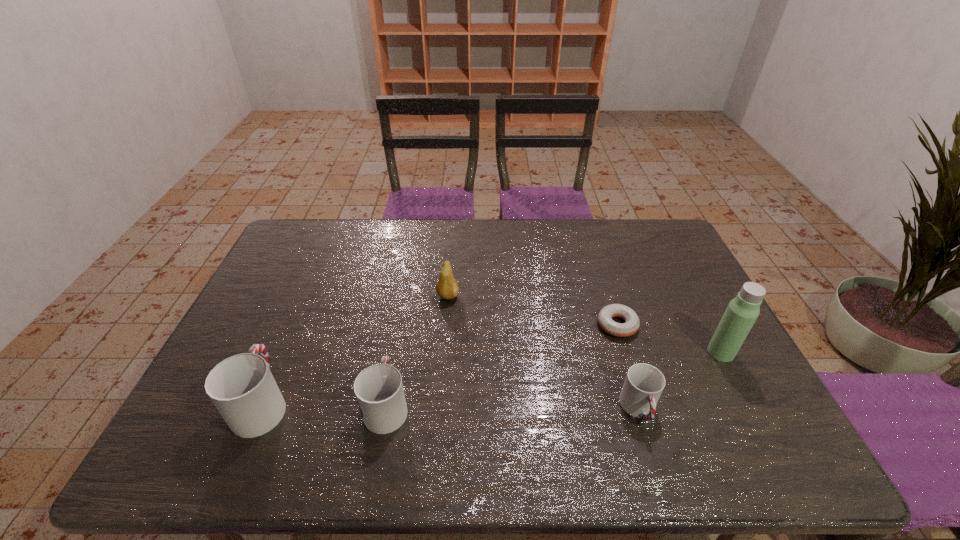
Where is `vacant area located 0.240m on the right of the shortest object`? vacant area located 0.240m on the right of the shortest object is located at coordinates (721, 325).

You are a GUI agent. You are given a task and a screenshot of the screen. Output one action in this format:
    pyautogui.click(x=<x>, y=<y>)
    Task: Click on the object present at the left edge
    This screenshot has height=540, width=960.
    Given the screenshot: What is the action you would take?
    pyautogui.click(x=242, y=388)

The height and width of the screenshot is (540, 960). Identify the location of object present at the right edge. (741, 313).

Locate an element on the screen. The image size is (960, 540). object at the near left corner is located at coordinates (242, 388).

Identify the location of vacant space at the far edge of the desktop. This screenshot has width=960, height=540. pyautogui.click(x=533, y=253).

This screenshot has width=960, height=540. I want to click on vacant space at the near edge of the desktop, so click(x=560, y=394).

Identify the location of free space at the left edge. (236, 350).

Image resolution: width=960 pixels, height=540 pixels. Identify the location of free space at the right edge. (711, 305).

The image size is (960, 540). In the image, there is a desktop. Find the location of `vacant region at the far left corner`. vacant region at the far left corner is located at coordinates (331, 230).

This screenshot has width=960, height=540. I want to click on free space between the leftmost cup and the second shortest object, so click(450, 406).